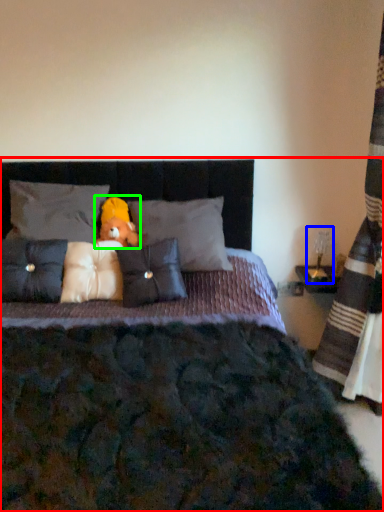
Question: Considering the real-world distances, which object is farthest from bed (highlighted by a red box)? table lamp (highlighted by a blue box) or toy (highlighted by a green box)?

Choices:
 (A) table lamp
 (B) toy

Answer: (A)